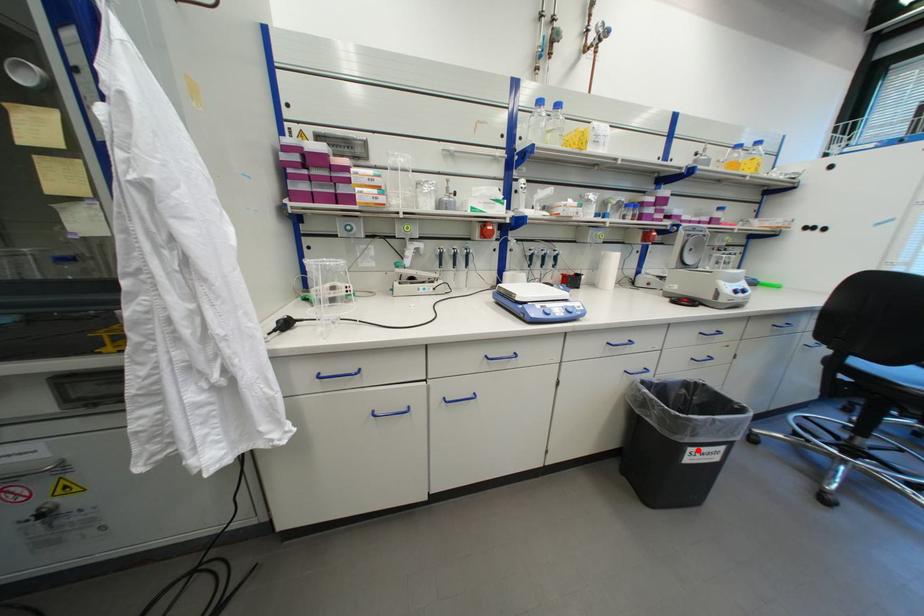
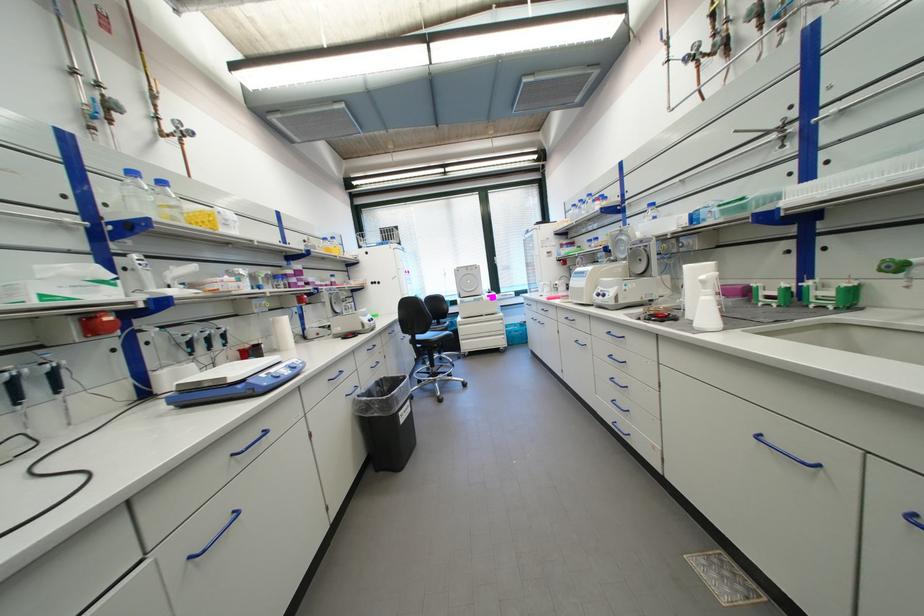
The point at the highlighted location is marked in the first image. Where is the corresponding point in the second image?

(407, 415)